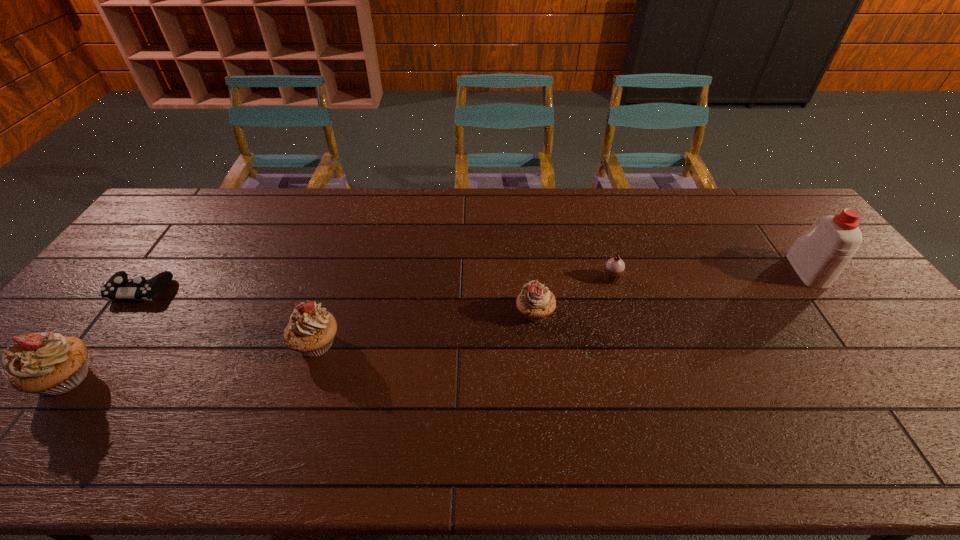
The cupcakes are evenly distributed in the image. To maintain this, where would you place another cupcake on the right? Please point to a free space. Please provide its 2D coordinates. Your answer should be formatted as a tuple, i.e. [(x, y)], where the tuple contains the x and y coordinates of a point satisfying the conditions above.

[(729, 286)]